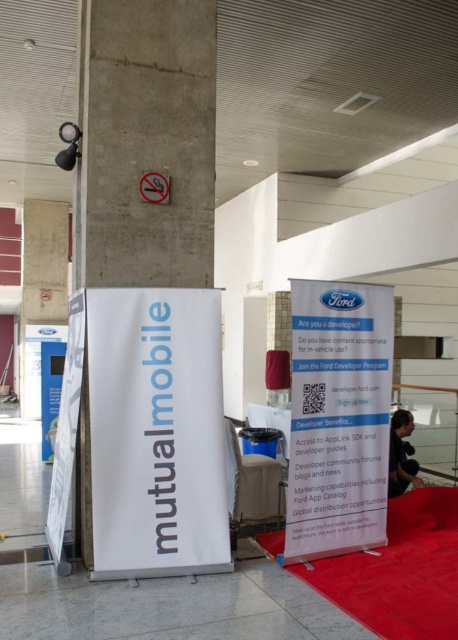
You are a visitor in the conference hall and need to place a 3.5 feet wide table between the white matte pillar at left and the white paper signboard at center. Is there enough space?

The distance between the white matte pillar at left and the white paper signboard at center is 3.62 feet. Since the table is 3.5 feet wide, it can fit within the available space as 3.5 is less than 3.62.

You are an event organizer who needs to place a new 1.2 meter wide promotional banner between the white matte pillar at left and the white paperboard at center. Based on their sizes, will there be enough space for the banner?

The white matte pillar at left has a smaller size compared to white paperboard at center. Since the pillar is smaller, the space between them might be sufficient to accommodate the 1.2 meter wide banner, but exact dimensions are needed for confirmation.